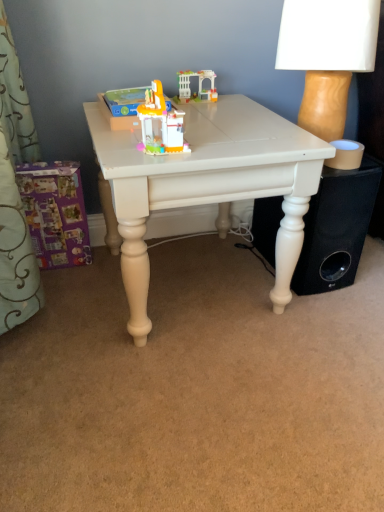
Where is `free space in front of white plastic arch at center, marked as the first toy in a back-to-front arrangement`? free space in front of white plastic arch at center, marked as the first toy in a back-to-front arrangement is located at coordinates (204, 109).